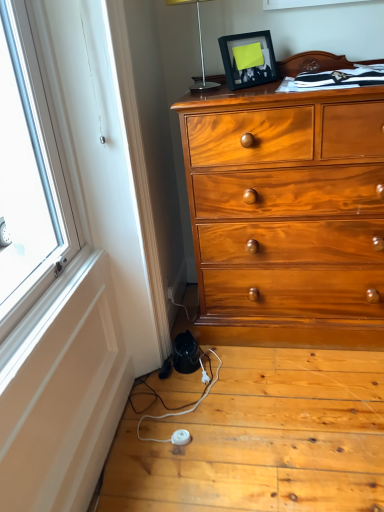
Question: From a real-world perspective, is silver metallic table lamp at upper center beneath white plastic power strip at lower center?

Choices:
 (A) no
 (B) yes

Answer: (A)

Question: Considering the relative sizes of silver metallic table lamp at upper center and white plastic power strip at lower center in the image provided, is silver metallic table lamp at upper center taller than white plastic power strip at lower center?

Choices:
 (A) no
 (B) yes

Answer: (B)

Question: Are silver metallic table lamp at upper center and white plastic power strip at lower center far apart?

Choices:
 (A) no
 (B) yes

Answer: (B)

Question: Could you tell me if silver metallic table lamp at upper center is facing white plastic power strip at lower center?

Choices:
 (A) yes
 (B) no

Answer: (B)

Question: Is silver metallic table lamp at upper center turned away from white plastic power strip at lower center?

Choices:
 (A) no
 (B) yes

Answer: (A)

Question: Is white plastic power strip at lower center surrounded by silver metallic table lamp at upper center?

Choices:
 (A) no
 (B) yes

Answer: (A)

Question: Is white plastic power strip at lower center outside of silver metallic table lamp at upper center?

Choices:
 (A) yes
 (B) no

Answer: (A)

Question: From a real-world perspective, is white plastic power strip at lower center located beneath silver metallic table lamp at upper center?

Choices:
 (A) yes
 (B) no

Answer: (A)

Question: Is white plastic power strip at lower center in contact with silver metallic table lamp at upper center?

Choices:
 (A) yes
 (B) no

Answer: (B)

Question: Considering the relative positions of white plastic power strip at lower center and silver metallic table lamp at upper center in the image provided, is white plastic power strip at lower center to the left of silver metallic table lamp at upper center from the viewer's perspective?

Choices:
 (A) no
 (B) yes

Answer: (B)

Question: Is white plastic power strip at lower center facing away from silver metallic table lamp at upper center?

Choices:
 (A) no
 (B) yes

Answer: (A)

Question: Can silver metallic table lamp at upper center be found inside white plastic power strip at lower center?

Choices:
 (A) no
 (B) yes

Answer: (A)

Question: Is black matte picture frame at upper center thinner than silver metallic table lamp at upper center?

Choices:
 (A) no
 (B) yes

Answer: (B)